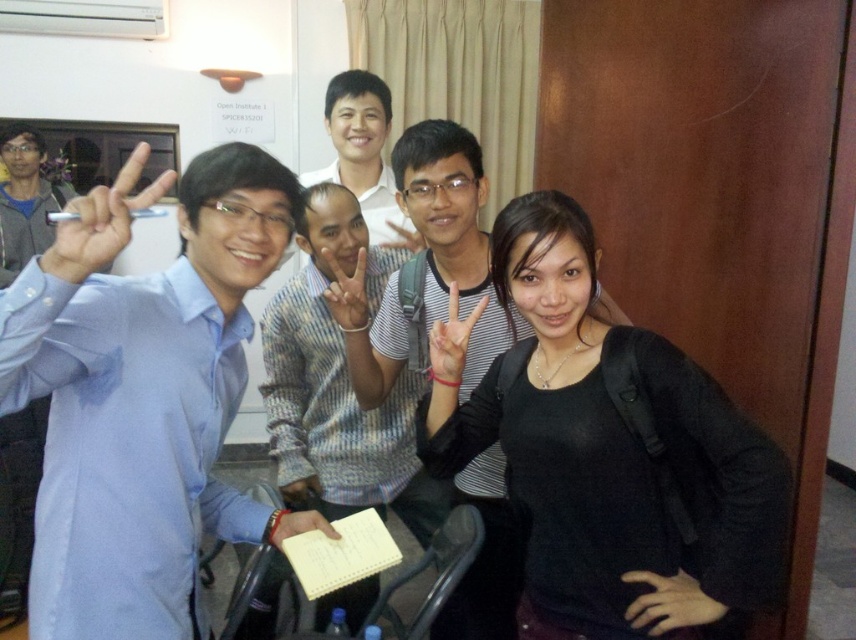
Question: Which of the following is the closest to the observer?

Choices:
 (A) click(x=690, y=593)
 (B) click(x=504, y=486)

Answer: (A)

Question: From the image, what is the correct spatial relationship of light blue shirt at left in relation to matte black hand at center?

Choices:
 (A) below
 (B) above

Answer: (A)

Question: Which object appears farthest from the camera in this image?

Choices:
 (A) striped cotton shirt at center
 (B) black matte hand at lower right

Answer: (A)

Question: Is striped sweater at center below matte blue shirt at left?

Choices:
 (A) yes
 (B) no

Answer: (A)

Question: Is matte black pen at left to the right of white paper at center from the viewer's perspective?

Choices:
 (A) yes
 (B) no

Answer: (B)

Question: Which point is closer to the camera?

Choices:
 (A) striped sweater at center
 (B) matte black hand at center
 (C) light blue shirt at left
 (D) black matte shirt at center

Answer: (C)